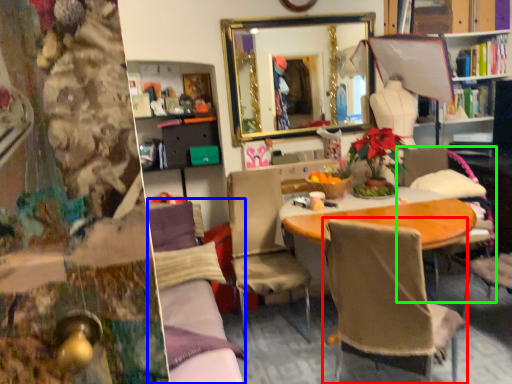
Question: Estimate the real-world distances between objects in this image. Which object is closer to chair (highlighted by a red box), couch (highlighted by a blue box) or chair (highlighted by a green box)?

Choices:
 (A) couch
 (B) chair

Answer: (A)